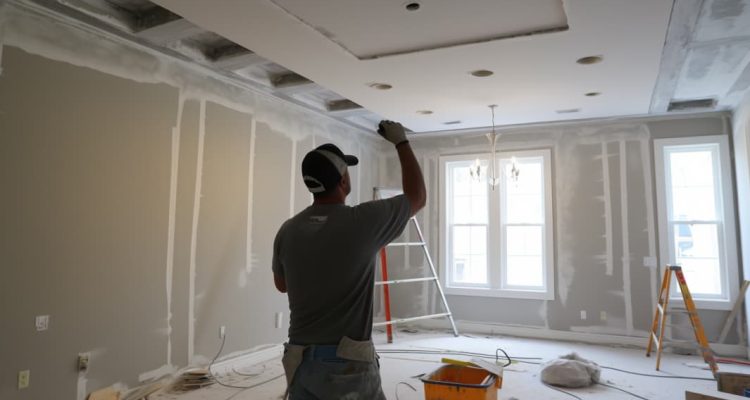
You are a GUI agent. You are given a task and a screenshot of the screen. Output one action in this format:
    pyautogui.click(x=<x>, y=<y>)
    Task: Click on the cords
    The image size is (750, 400).
    Given the screenshot: What is the action you would take?
    pyautogui.click(x=229, y=387), pyautogui.click(x=276, y=378), pyautogui.click(x=424, y=349), pyautogui.click(x=484, y=356), pyautogui.click(x=633, y=372)